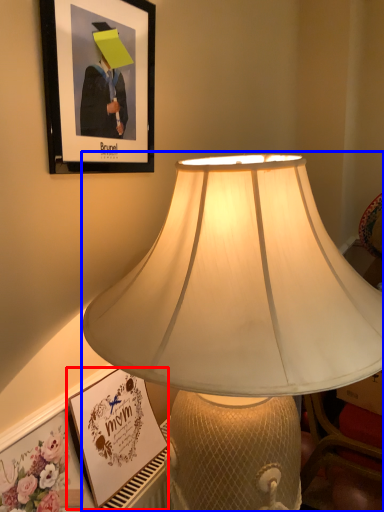
Question: Among these objects, which one is nearest to the camera, picture frame (highlighted by a red box) or lamp (highlighted by a blue box)?

Choices:
 (A) picture frame
 (B) lamp

Answer: (B)